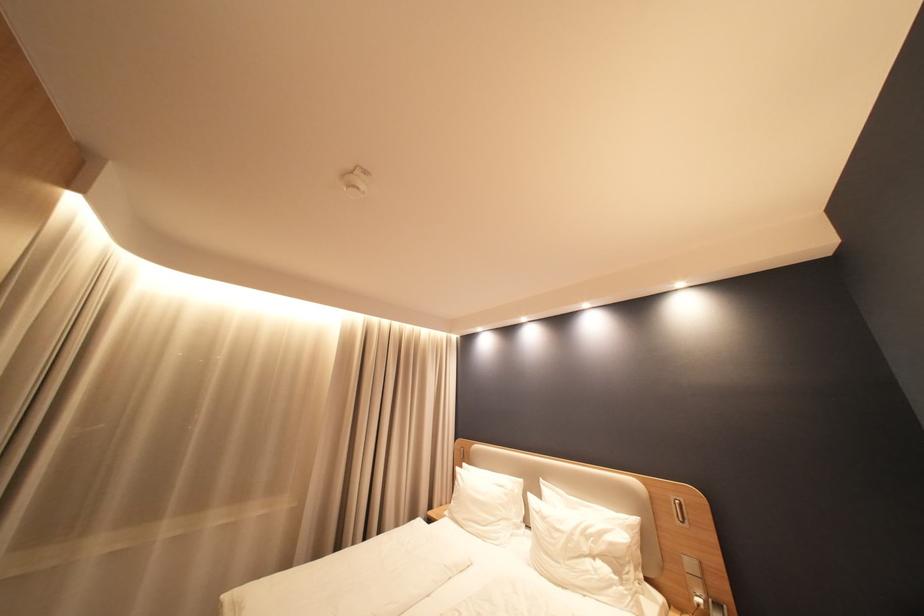
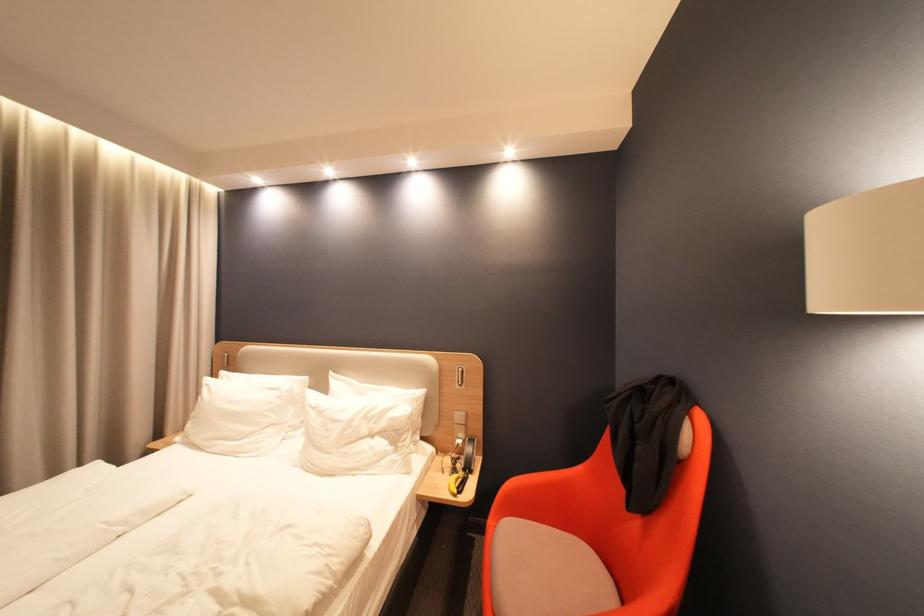
How did the camera likely rotate?

The camera rotated toward right-down.